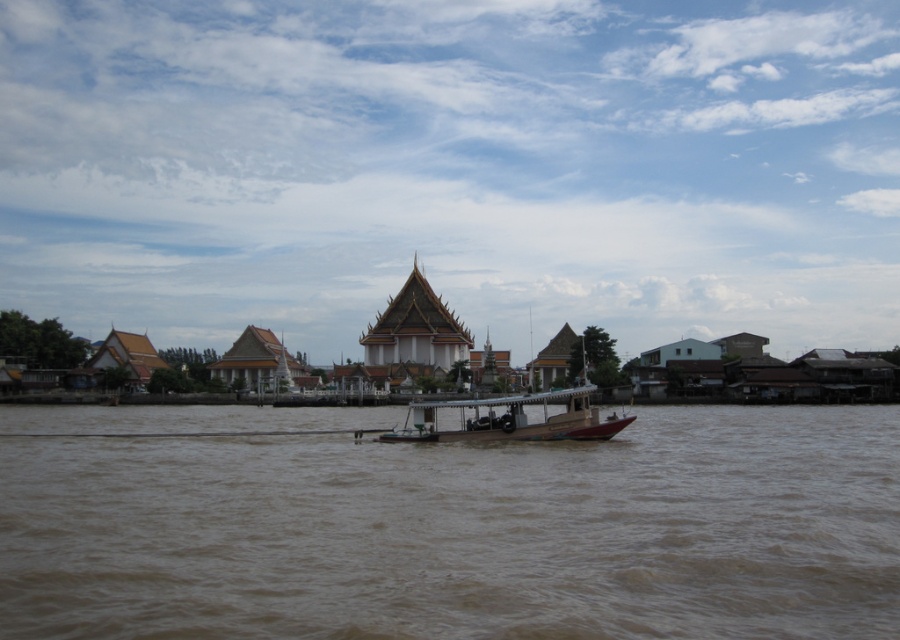
You are a photographer planning to capture the wooden boat at center in a composition that emphasizes its size relative to the brown muddy water at center. Based on the scene, which element would appear wider in the photo?

The brown muddy water at center appears wider than the wooden boat at center in the photo.

Based on the photo, you are standing on the riverside and see the wooden boat at center and the brown muddy water at center. Which object is positioned to the right of the other?

The brown muddy water at center is to the right of the wooden boat at center.